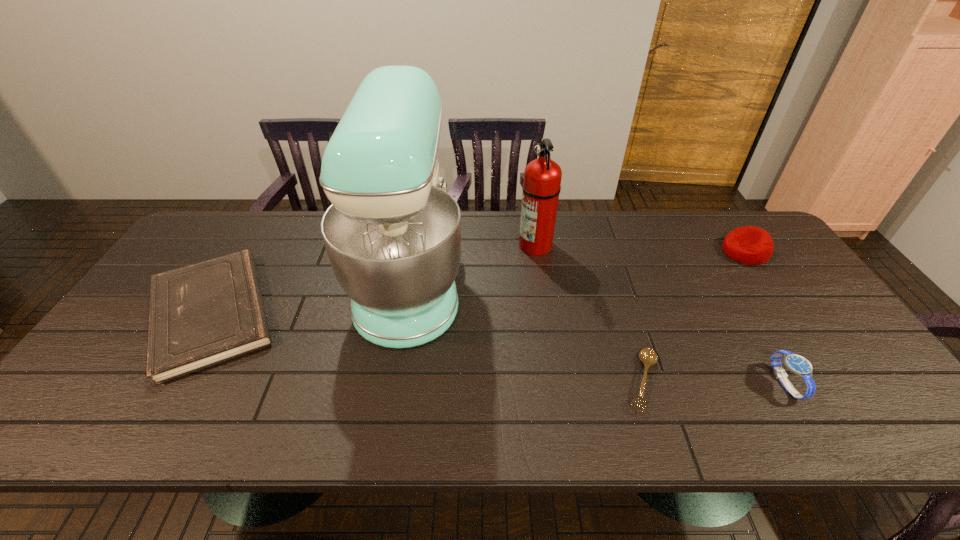
Identify the location of blank space at the right edge of the desktop. (797, 345).

I want to click on vacant area at the far left corner of the desktop, so click(192, 246).

You are a GUI agent. You are given a task and a screenshot of the screen. Output one action in this format:
    pyautogui.click(x=<x>, y=<y>)
    Task: Click on the blank space at the near left corner of the desktop
    The image size is (960, 540).
    Given the screenshot: What is the action you would take?
    pyautogui.click(x=84, y=410)

Find the location of `free region at the far right corner of the desktop`. free region at the far right corner of the desktop is located at coordinates (724, 232).

The width and height of the screenshot is (960, 540). Identify the location of vacant region at the near right corner of the desktop. (842, 404).

The height and width of the screenshot is (540, 960). Identify the location of vacant area between the beanbag and the second shortest object. (478, 282).

Where is `vacant area that lies between the shortest object and the leftmost object`? vacant area that lies between the shortest object and the leftmost object is located at coordinates (427, 347).

The width and height of the screenshot is (960, 540). What are the coordinates of `free area in between the second object from left to right and the third object from right to left` in the screenshot? It's located at (527, 330).

Where is `vacant space that's between the rightmost object and the fifth object from left to right`? The image size is (960, 540). vacant space that's between the rightmost object and the fifth object from left to right is located at coordinates (765, 318).

At what (x,y) coordinates should I click in order to perform the action: click on empty location between the rightmost object and the fourth object from left to right. Please return your answer as a coordinate pair (x, y). The width and height of the screenshot is (960, 540). Looking at the image, I should click on (694, 316).